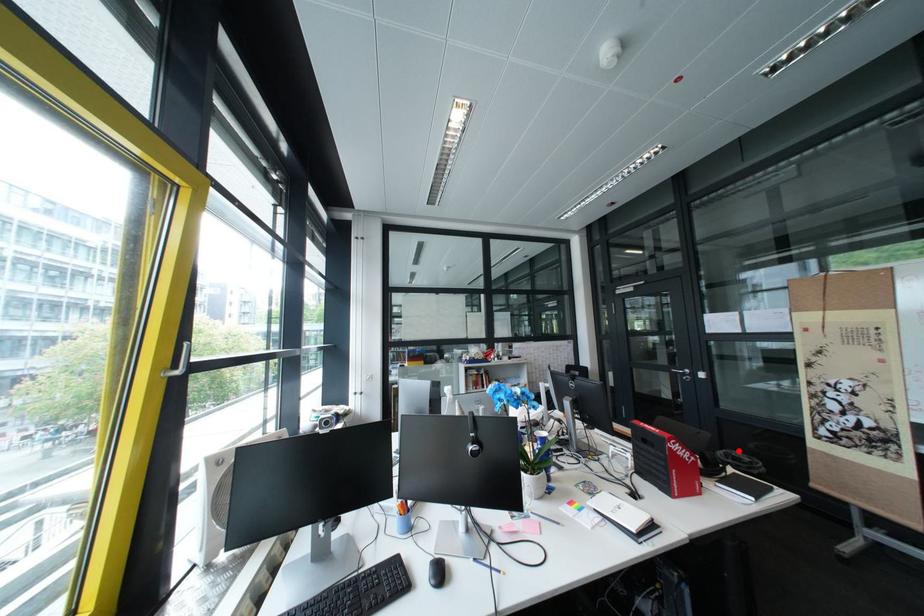
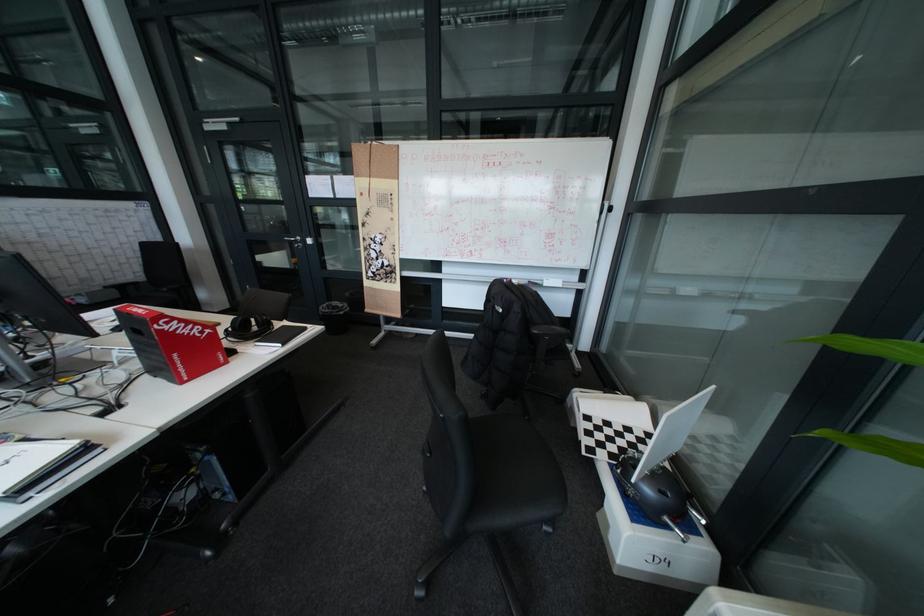
The point at the highlighted location is marked in the first image. Where is the corresponding point in the second image?

(341, 304)